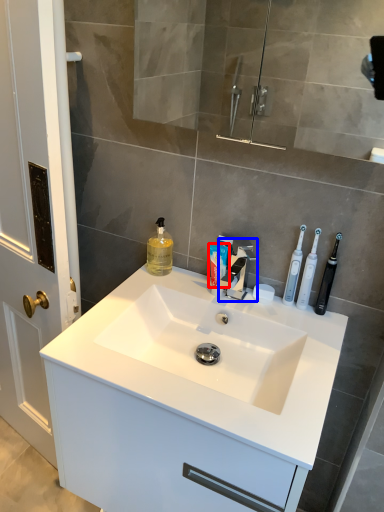
Question: Among these objects, which one is nearest to the camera, toothpaste (highlighted by a red box) or tap (highlighted by a blue box)?

Choices:
 (A) toothpaste
 (B) tap

Answer: (B)